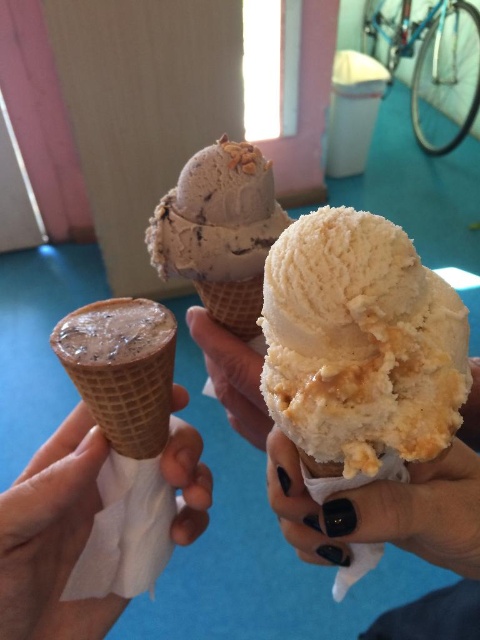
Where is `vanilla ice cream at center`? This screenshot has height=640, width=480. vanilla ice cream at center is located at coordinates (360, 342).

Is vanilla ice cream at center to the left of brown waffle cone at center from the viewer's perspective?

Incorrect, vanilla ice cream at center is not on the left side of brown waffle cone at center.

Identify the location of vanilla ice cream at center. This screenshot has height=640, width=480. (360, 342).

Can you confirm if black nail polish at center is positioned to the left of chocolate chip ice cream at center?

No, black nail polish at center is not to the left of chocolate chip ice cream at center.

Can you confirm if black nail polish at center is positioned above chocolate chip ice cream at center?

Incorrect, black nail polish at center is not positioned above chocolate chip ice cream at center.

What do you see at coordinates (383, 509) in the screenshot?
I see `black nail polish at center` at bounding box center [383, 509].

I want to click on black nail polish at center, so click(383, 509).

From the picture: Between chocolate chip ice cream at center and chocolate waffle cone at left, which one appears on the right side from the viewer's perspective?

Positioned to the right is chocolate chip ice cream at center.

Is chocolate chip ice cream at center closer to the viewer compared to chocolate waffle cone at left?

No.

The height and width of the screenshot is (640, 480). What do you see at coordinates (219, 230) in the screenshot?
I see `chocolate chip ice cream at center` at bounding box center [219, 230].

Where is `chocolate chip ice cream at center`? chocolate chip ice cream at center is located at coordinates (219, 230).